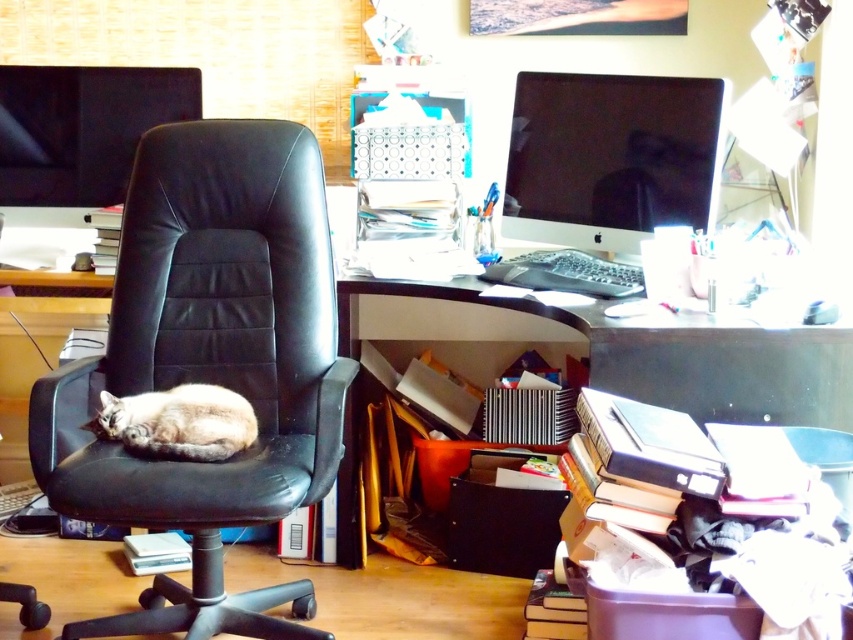
You are standing in the home office and want to place a new plant pot at the point marked as point [613,349]. Which object is located at this point?

The wooden desk at lower right is located at point [613,349].